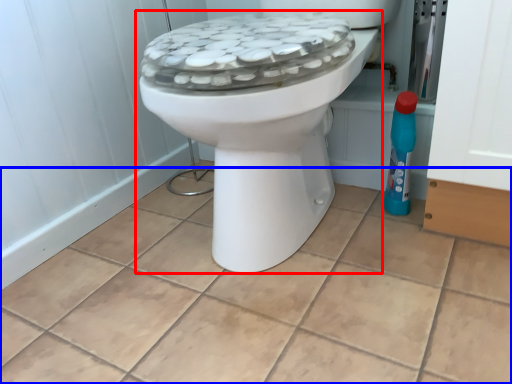
Question: Which object is further to the camera taking this photo, toilet (highlighted by a red box) or ceramic tile (highlighted by a blue box)?

Choices:
 (A) toilet
 (B) ceramic tile

Answer: (A)